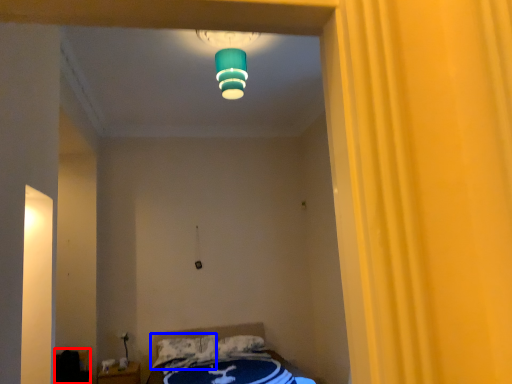
Question: Which object appears farthest to the camera in this image, furniture (highlighted by a red box) or pillow (highlighted by a blue box)?

Choices:
 (A) furniture
 (B) pillow

Answer: (B)